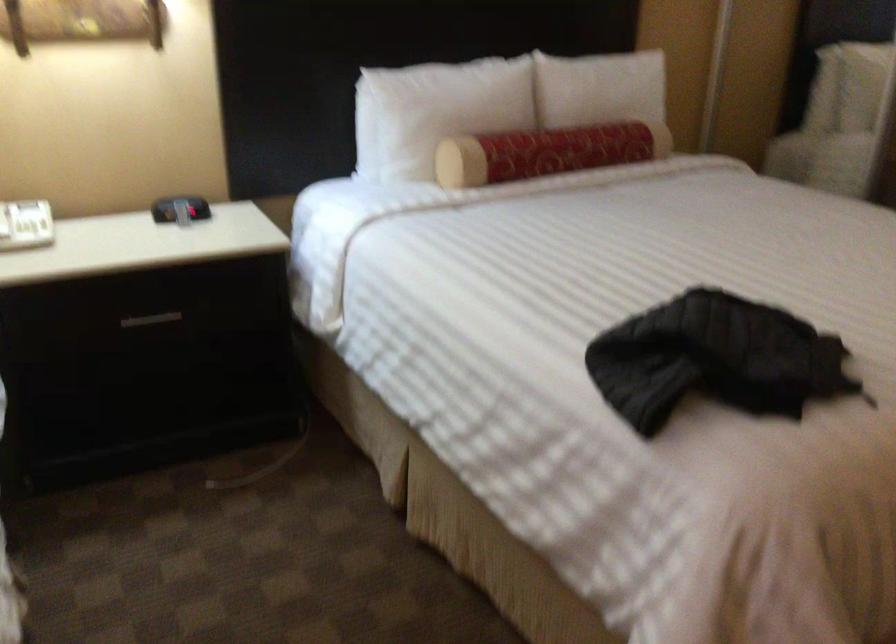
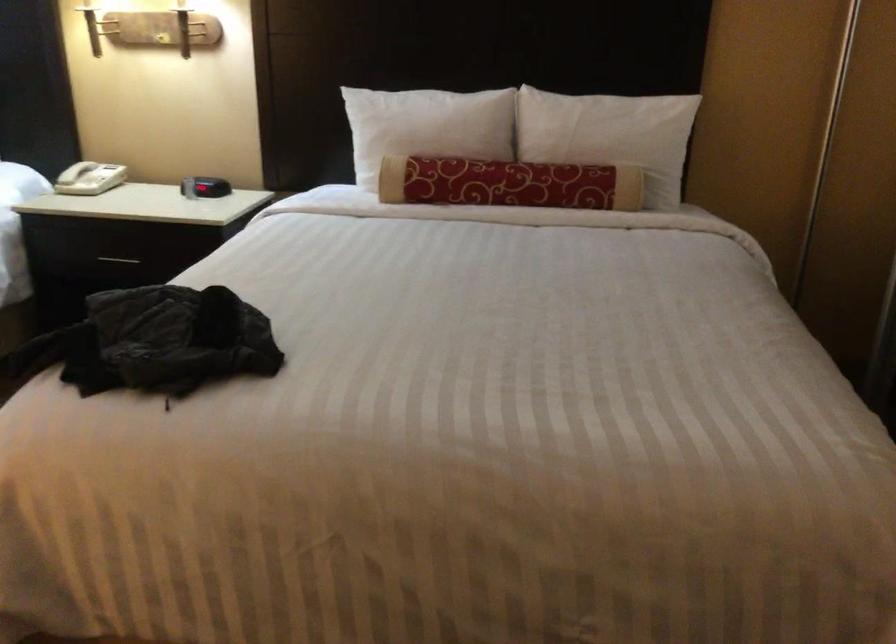
In the second image, find the point that corresponds to point 179,209 in the first image.

(177, 178)